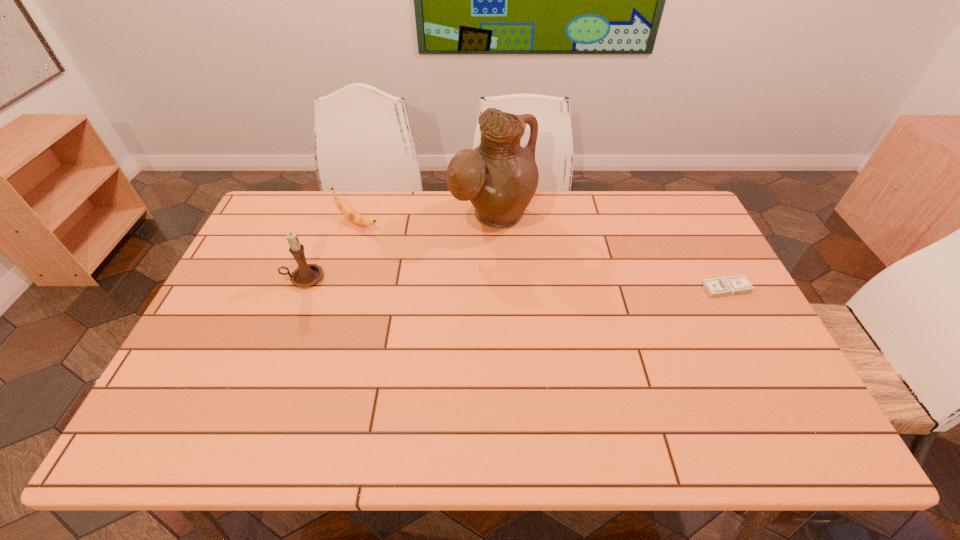
This screenshot has height=540, width=960. Find the location of `candle holder`. candle holder is located at coordinates (305, 275).

This screenshot has height=540, width=960. Find the location of `money`. money is located at coordinates 730,285.

At what (x,y) coordinates should I click in order to perform the action: click on the rightmost object. Please return your answer as a coordinate pair (x, y). Looking at the image, I should click on (730, 285).

I want to click on the tallest object, so (499, 177).

The image size is (960, 540). I want to click on the third object from left to right, so click(x=499, y=177).

The height and width of the screenshot is (540, 960). I want to click on banana, so click(x=350, y=214).

You are a GUI agent. You are given a task and a screenshot of the screen. Output one action in this format:
    pyautogui.click(x=<x>, y=<y>)
    Task: Click on the blank area located on the side of the candle holder with the handle
    The image size is (960, 540).
    Given the screenshot: What is the action you would take?
    coord(250,279)

You are a GUI agent. You are given a task and a screenshot of the screen. Output one action in this format:
    pyautogui.click(x=<x>, y=<y>)
    Task: Click on the vacant region located on the side of the candle holder with the handle
    The image size is (960, 540).
    Given the screenshot: What is the action you would take?
    pyautogui.click(x=267, y=279)

Locate an element on the screen. The width and height of the screenshot is (960, 540). vacant area located 0.090m on the side of the candle holder with the handle is located at coordinates (253, 279).

The image size is (960, 540). I want to click on free space located 0.280m on the back of the rightmost object, so click(x=690, y=219).